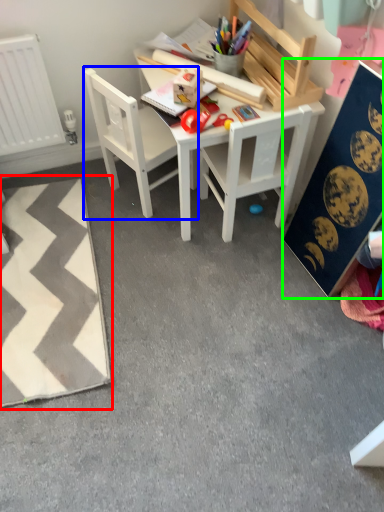
Question: Estimate the real-world distances between objects in this image. Which object is closer to mat (highlighted by a red box), chair (highlighted by a blue box) or bulletin board (highlighted by a green box)?

Choices:
 (A) chair
 (B) bulletin board

Answer: (A)